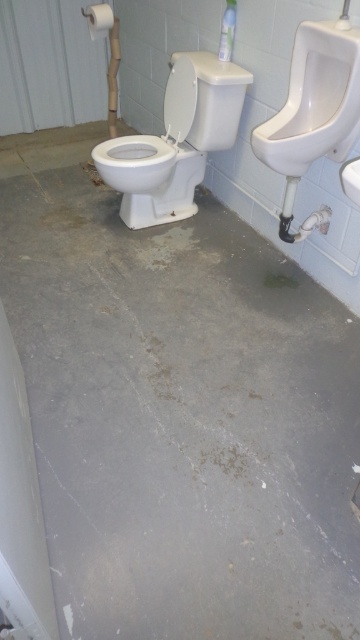
Question: Can you confirm if white glossy urinal at upper right is positioned to the right of white glossy sink at upper right?

Choices:
 (A) yes
 (B) no

Answer: (A)

Question: Is white glossy toilet bowl at center positioned behind white glossy sink at upper right?

Choices:
 (A) no
 (B) yes

Answer: (B)

Question: Does white glossy toilet bowl at center have a lesser width compared to white glossy urinal at upper right?

Choices:
 (A) no
 (B) yes

Answer: (A)

Question: Which point appears closest to the camera in this image?

Choices:
 (A) (171, 104)
 (B) (344, 188)
 (C) (325, 48)

Answer: (B)

Question: Which of the following is the farthest from the observer?

Choices:
 (A) white glossy sink at upper right
 (B) white glossy urinal at upper right

Answer: (B)

Question: Considering the real-world distances, which object is closest to the white glossy urinal at upper right?

Choices:
 (A) white glossy toilet bowl at center
 (B) white glossy sink at upper right

Answer: (B)